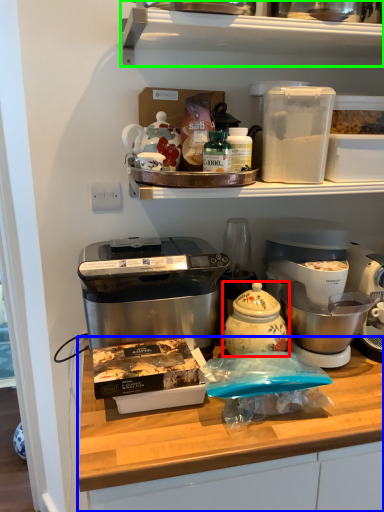
Question: Which object is positioned farthest from kitchen appliance (highlighted by a red box)? Select from table (highlighted by a blue box) and shelf (highlighted by a green box).

Choices:
 (A) table
 (B) shelf

Answer: (B)